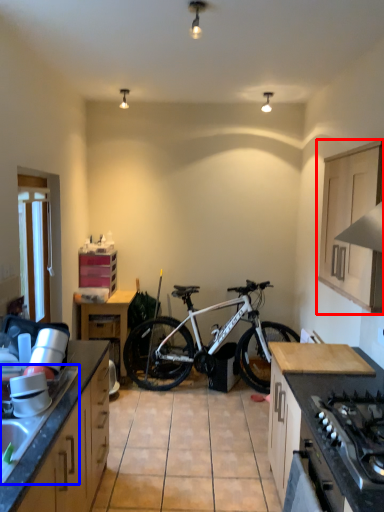
Question: Which of the following is the closest to the observer, cabinetry (highlighted by a red box) or sink (highlighted by a blue box)?

Choices:
 (A) cabinetry
 (B) sink

Answer: (B)